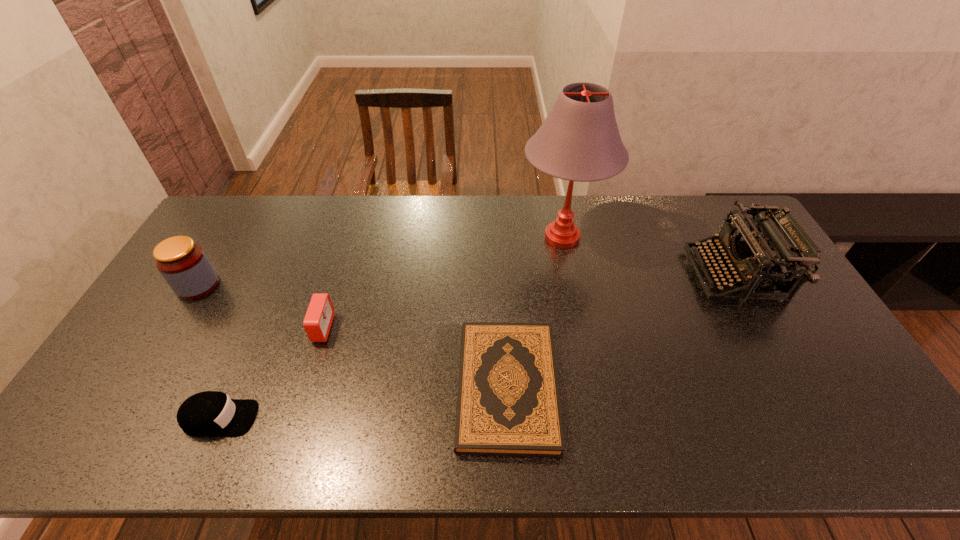
The image size is (960, 540). In order to click on vacant space located 0.140m on the front-facing side of the tallest object in this screenshot , I will do `click(574, 301)`.

At what (x,y) coordinates should I click in order to perform the action: click on free location located 0.130m on the typing side of the rightmost object. Please return your answer as a coordinate pair (x, y). Image resolution: width=960 pixels, height=540 pixels. Looking at the image, I should click on (651, 275).

Identify the location of free point located 0.400m on the typing side of the rightmost object. The height and width of the screenshot is (540, 960). (566, 275).

You are a GUI agent. You are given a task and a screenshot of the screen. Output one action in this format:
    pyautogui.click(x=<x>, y=<y>)
    Task: Click on the free region located on the typing side of the rightmost object
    The height and width of the screenshot is (540, 960).
    Given the screenshot: What is the action you would take?
    [x=595, y=275]

You are a GUI agent. You are given a task and a screenshot of the screen. Output one action in this format:
    pyautogui.click(x=<x>, y=<y>)
    Task: Click on the vacant area located on the front of the jar
    This screenshot has height=540, width=960.
    Given the screenshot: What is the action you would take?
    pyautogui.click(x=156, y=353)

Locate an element on the screen. This screenshot has width=960, height=540. vacant space located 0.280m on the front-facing side of the alarm clock is located at coordinates (429, 328).

Identify the location of vacant space located on the front-facing side of the second shortest object. (362, 418).

Identify the location of vacant space situated 0.190m on the right of the shortest object. The width and height of the screenshot is (960, 540). (632, 388).

Locate an element on the screen. This screenshot has width=960, height=540. object located in the far edge section of the desktop is located at coordinates (579, 140).

Locate an element on the screen. cap that is at the near edge is located at coordinates (210, 413).